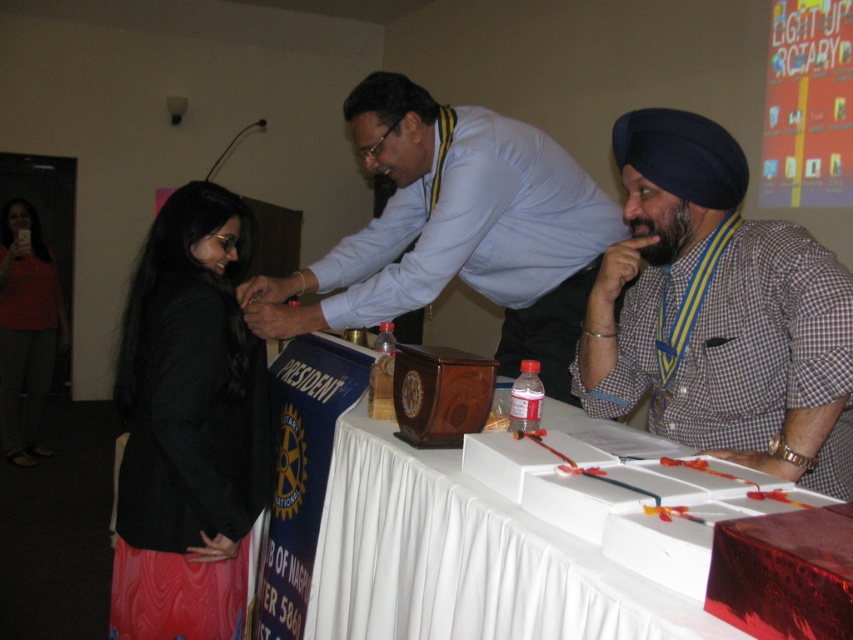
You are standing at the camera position and want to reach point (212, 314). Is the distance less than 2 meters?

The distance between point (212, 314) and the camera is 1.66 meters, which is less than 2 meters.

You are organizing a small ceremony and need to place a decorative centerpiece on the table. Given the white wood table at center and the matte wood box at center, which object can accommodate a larger centerpiece?

The white wood table at center has a larger size compared to the matte wood box at center, so it can accommodate a larger centerpiece.